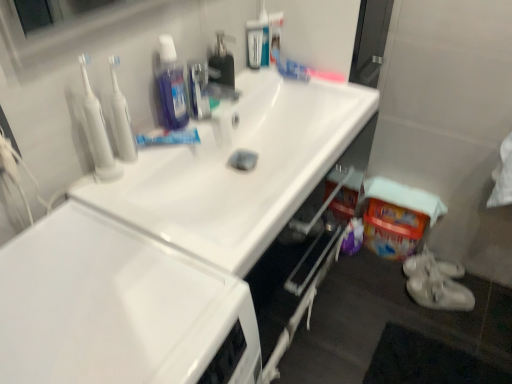
Locate an element on the screen. translucent plastic bottle at upper center, the first cleaning products when ordered from right to left is located at coordinates (275, 33).

The height and width of the screenshot is (384, 512). Describe the element at coordinates (238, 170) in the screenshot. I see `white glossy sink at upper center` at that location.

This screenshot has width=512, height=384. Identify the location of clear plastic bottle at upper center, positioned as the second cleaning products in right-to-left order. (254, 43).

Image resolution: width=512 pixels, height=384 pixels. Describe the element at coordinates (254, 43) in the screenshot. I see `clear plastic bottle at upper center, the third cleaning products when ordered from left to right` at that location.

The height and width of the screenshot is (384, 512). What are the coordinates of `translucent plastic bottle at upper center, the first cleaning products when ordered from right to left` in the screenshot? It's located at pos(275,33).

Is white plastic toothbrushes at upper left, the first cleanser from the right, a part of clear plastic bottle at upper center, positioned as the second cleaning products in right-to-left order?

No, white plastic toothbrushes at upper left, the first cleanser from the right, is not inside clear plastic bottle at upper center, positioned as the second cleaning products in right-to-left order.

Is clear plastic bottle at upper center, positioned as the second cleaning products in right-to-left order, with white plastic toothbrushes at upper left, the first cleanser from the right?

There is a gap between clear plastic bottle at upper center, positioned as the second cleaning products in right-to-left order, and white plastic toothbrushes at upper left, the first cleanser from the right.

Based on the photo, is clear plastic bottle at upper center, the third cleaning products when ordered from left to right, wider than white plastic toothbrushes at upper left, the first cleanser from the right?

Incorrect, the width of clear plastic bottle at upper center, the third cleaning products when ordered from left to right, does not surpass that of white plastic toothbrushes at upper left, the first cleanser from the right.

Is translucent plastic soap dispenser at center, the 3th cleaning products when ordered from right to left, not within white glossy sink at upper center?

Yes, translucent plastic soap dispenser at center, the 3th cleaning products when ordered from right to left, is located beyond the bounds of white glossy sink at upper center.

Between translucent plastic soap dispenser at center, the 3th cleaning products when ordered from right to left, and white glossy sink at upper center, which one has more height?

white glossy sink at upper center.

From a real-world perspective, which object stands above the other?

In real-world perspective, translucent plastic soap dispenser at center, the 3th cleaning products when ordered from right to left, is above.

From the picture: Is translucent plastic soap dispenser at center, which appears as the second cleaning products when viewed from the left, facing towards white glossy sink at upper center?

No, translucent plastic soap dispenser at center, which appears as the second cleaning products when viewed from the left, is not turned towards white glossy sink at upper center.

How different are the orientations of translucent plastic soap dispenser at center, the 3th cleaning products when ordered from right to left, and translucent purple bottle at upper center, which appears as the fourth cleaning products when viewed from the right, in degrees?

They differ by 3.67e-05 degrees in their facing directions.

Would you say translucent purple bottle at upper center, which appears as the fourth cleaning products when viewed from the right, is part of translucent plastic soap dispenser at center, which appears as the second cleaning products when viewed from the left,'s contents?

No, translucent purple bottle at upper center, which appears as the fourth cleaning products when viewed from the right, is not inside translucent plastic soap dispenser at center, which appears as the second cleaning products when viewed from the left.

From their relative heights in the image, would you say translucent plastic soap dispenser at center, which appears as the second cleaning products when viewed from the left, is taller or shorter than translucent purple bottle at upper center, which is counted as the first cleaning products, starting from the left?

translucent plastic soap dispenser at center, which appears as the second cleaning products when viewed from the left, is shorter than translucent purple bottle at upper center, which is counted as the first cleaning products, starting from the left.

Does translucent plastic soap dispenser at center, which appears as the second cleaning products when viewed from the left, have a lesser width compared to translucent purple bottle at upper center, which appears as the fourth cleaning products when viewed from the right?

No.

Are clear plastic bottle at upper center, the third cleaning products when ordered from left to right, and translucent plastic toothbrush at upper center located far from each other?

No, clear plastic bottle at upper center, the third cleaning products when ordered from left to right, is in close proximity to translucent plastic toothbrush at upper center.

Is clear plastic bottle at upper center, the third cleaning products when ordered from left to right, oriented away from translucent plastic toothbrush at upper center?

No, translucent plastic toothbrush at upper center is not at the back of clear plastic bottle at upper center, the third cleaning products when ordered from left to right.

Can you confirm if clear plastic bottle at upper center, the third cleaning products when ordered from left to right, is shorter than translucent plastic toothbrush at upper center?

Correct, clear plastic bottle at upper center, the third cleaning products when ordered from left to right, is not as tall as translucent plastic toothbrush at upper center.

Is metallic silver faucet at upper center positioned beyond the bounds of translucent plastic bottle at upper center, placed as the 4th cleaning products when sorted from left to right?

Yes, metallic silver faucet at upper center is located beyond the bounds of translucent plastic bottle at upper center, placed as the 4th cleaning products when sorted from left to right.

Can you confirm if metallic silver faucet at upper center is bigger than translucent plastic bottle at upper center, placed as the 4th cleaning products when sorted from left to right?

Correct, metallic silver faucet at upper center is larger in size than translucent plastic bottle at upper center, placed as the 4th cleaning products when sorted from left to right.

Is metallic silver faucet at upper center far from translucent plastic bottle at upper center, placed as the 4th cleaning products when sorted from left to right?

They are positioned close to each other.

Is metallic silver faucet at upper center oriented away from translucent purple bottle at upper center, which is counted as the first cleaning products, starting from the left?

No, translucent purple bottle at upper center, which is counted as the first cleaning products, starting from the left, is not at the back of metallic silver faucet at upper center.

In the image, is metallic silver faucet at upper center on the left side or the right side of translucent purple bottle at upper center, which is counted as the first cleaning products, starting from the left?

metallic silver faucet at upper center is to the right of translucent purple bottle at upper center, which is counted as the first cleaning products, starting from the left.

Does metallic silver faucet at upper center have a greater width compared to translucent purple bottle at upper center, which appears as the fourth cleaning products when viewed from the right?

Yes.

Is white glossy cabinet at lower center not close to white plastic toothbrushes at upper left, which is the second cleanser from right to left?

No, there isn't a large distance between white glossy cabinet at lower center and white plastic toothbrushes at upper left, which is the second cleanser from right to left.

This screenshot has height=384, width=512. There is a white glossy cabinet at lower center. In order to click on the 2nd cleanser above it (from a real-world perspective) in this screenshot , I will do `click(98, 132)`.

How different are the orientations of white glossy cabinet at lower center and white plastic toothbrushes at upper left, which is the second cleanser from right to left, in degrees?

0.634 degrees separate the facing orientations of white glossy cabinet at lower center and white plastic toothbrushes at upper left, which is the second cleanser from right to left.

From the image's perspective, starting from the clear plastic bottle at upper center, positioned as the second cleaning products in right-to-left order, which cleanser is the 1st one below? Please provide its 2D coordinates.

[(121, 118)]

This screenshot has height=384, width=512. What are the coordinates of `the 2nd cleaning products behind when counting from the white glossy sink at upper center` in the screenshot? It's located at (222, 61).

Considering their positions, is white glossy cabinet at lower center positioned closer to white fabric towel at lower right than white plastic toothbrushes at upper left, which is the second cleanser from right to left?

white plastic toothbrushes at upper left, which is the second cleanser from right to left.

When comparing their distances from white fabric towel at lower right, does clear plastic bottle at upper center, positioned as the second cleaning products in right-to-left order, or translucent plastic bottle at upper center, placed as the 4th cleaning products when sorted from left to right, seem further?

Among the two, clear plastic bottle at upper center, positioned as the second cleaning products in right-to-left order, is located further to white fabric towel at lower right.

When comparing their distances from metallic silver faucet at upper center, does translucent plastic toothbrush at upper center or white plastic toothbrushes at upper left, the first cleanser from the right, seem further?

translucent plastic toothbrush at upper center.

Considering their positions, is white glossy sink at upper center positioned further to translucent plastic soap dispenser at center, which appears as the second cleaning products when viewed from the left, than translucent plastic bottle at upper center, the first cleaning products when ordered from right to left?

Among the two, white glossy sink at upper center is located further to translucent plastic soap dispenser at center, which appears as the second cleaning products when viewed from the left.

Looking at the image, which one is located further to white plastic toothbrushes at upper left, which is the second cleanser from right to left, translucent purple bottle at upper center, which is counted as the first cleaning products, starting from the left, or white fabric towel at lower right?

white fabric towel at lower right is further to white plastic toothbrushes at upper left, which is the second cleanser from right to left.

Which object lies further to the anchor point white glossy cabinet at lower center, white plastic toothbrushes at upper left, the first cleanser from the right, or clear plastic bottle at upper center, the third cleaning products when ordered from left to right?

The object further to white glossy cabinet at lower center is clear plastic bottle at upper center, the third cleaning products when ordered from left to right.

In the scene shown: Considering their positions, is translucent plastic toothbrush at upper center positioned further to white fabric towel at lower right than metallic silver faucet at upper center?

Based on the image, metallic silver faucet at upper center appears to be further to white fabric towel at lower right.

Which object lies further to the anchor point white glossy cabinet at lower center, white glossy sink at upper center or metallic silver faucet at upper center?

metallic silver faucet at upper center is further to white glossy cabinet at lower center.

Image resolution: width=512 pixels, height=384 pixels. In order to click on faucet positioned between white plastic toothbrushes at upper left, which is the second cleanser from right to left, and clear plastic bottle at upper center, positioned as the second cleaning products in right-to-left order, from near to far in this screenshot , I will do `click(206, 89)`.

This screenshot has width=512, height=384. I want to click on cleanser positioned between white plastic toothbrushes at upper left, which ranks as the 1th cleanser in left-to-right order, and clear plastic bottle at upper center, the third cleaning products when ordered from left to right, from near to far, so click(x=121, y=118).

Find the location of a particular element. toothbrush between white glossy cabinet at lower center and white fabric towel at lower right in the front-back direction is located at coordinates (264, 33).

I want to click on sink between translucent purple bottle at upper center, which is counted as the first cleaning products, starting from the left, and white glossy cabinet at lower center from top to bottom, so click(238, 170).